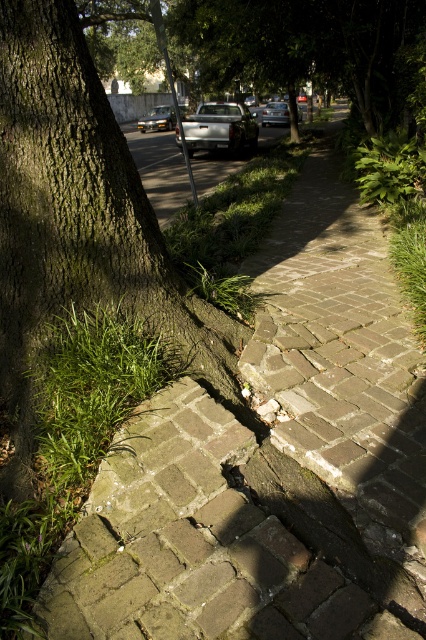
You are standing on the sidewalk in the residential street scene. You see a point marked at coordinates (80, 221). What object does this point correspond to?

The point at coordinates (80, 221) corresponds to the brown rough tree trunk at left.

You are a pedestrian walking on the sidewalk and want to cross the road to reach a park on the other side. The metallic silver sedan at center is parked on the road. Can you safely walk around the green leafy tree at upper center to get to the road?

The green leafy tree at upper center is positioned under the metallic silver sedan at center, meaning the tree is directly in front of the car. This would block your path, so you cannot safely walk around the tree to reach the road.

You are standing at the point marked as point (221, 128) in the image. What object is located exactly at that point?

The silver metallic truck at center is located exactly at point (221, 128).